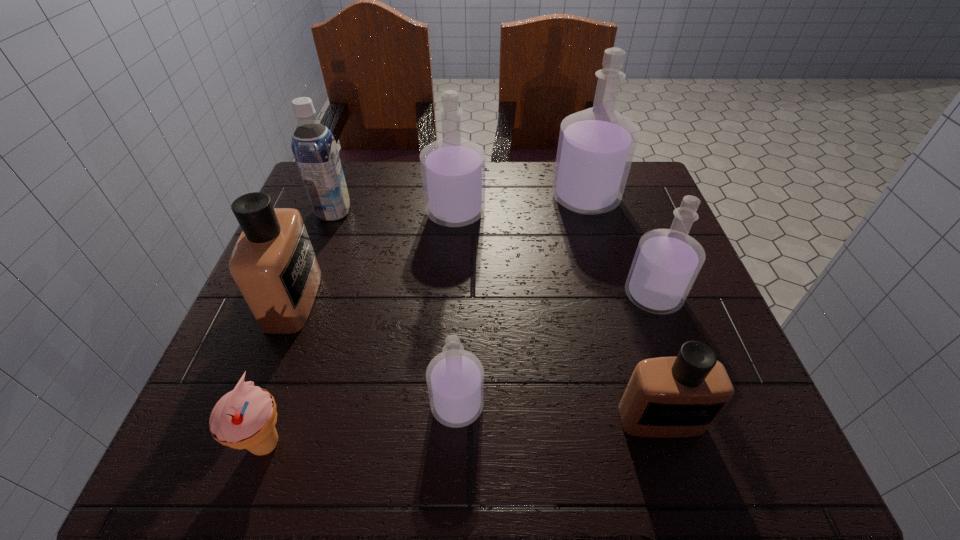
Where is `icecream`? icecream is located at coordinates (244, 418).

The height and width of the screenshot is (540, 960). Identify the location of free location located on the left of the biggest purple perfume. (406, 198).

The height and width of the screenshot is (540, 960). What are the coordinates of `vacant space located 0.240m on the left of the second biggest purple perfume` in the screenshot? It's located at (328, 213).

Locate an element on the screen. The image size is (960, 540). vacant point located on the label of the soya milk is located at coordinates (403, 212).

You are a GUI agent. You are given a task and a screenshot of the screen. Output one action in this format:
    pyautogui.click(x=<x>, y=<y>)
    Task: Click on the free space located 0.100m on the back of the third farthest purple perfume
    
    Given the screenshot: What is the action you would take?
    point(634,244)

This screenshot has width=960, height=540. In order to click on vacant space located 0.340m on the front label of the leftmost perfume in this screenshot , I will do 485,300.

The width and height of the screenshot is (960, 540). Find the location of `vacant space located 0.330m on the right of the nearest purple perfume`. vacant space located 0.330m on the right of the nearest purple perfume is located at coordinates [684, 405].

Locate an element on the screen. The height and width of the screenshot is (540, 960). vacant space located 0.090m on the right of the icecream is located at coordinates (352, 444).

At what (x,y) coordinates should I click in order to perform the action: click on soya milk that is at the far edge. Please return your answer as a coordinate pair (x, y). Looking at the image, I should click on (314, 147).

Where is `icecream located in the near edge section of the desktop`? icecream located in the near edge section of the desktop is located at coordinates (244, 418).